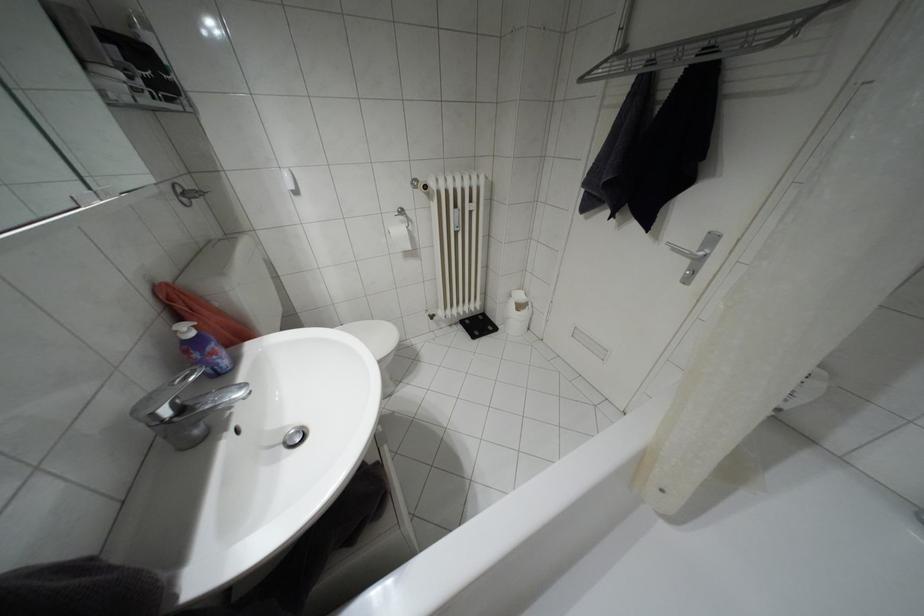
The image size is (924, 616). Identify the location of soap dispenser pump. point(185,328).